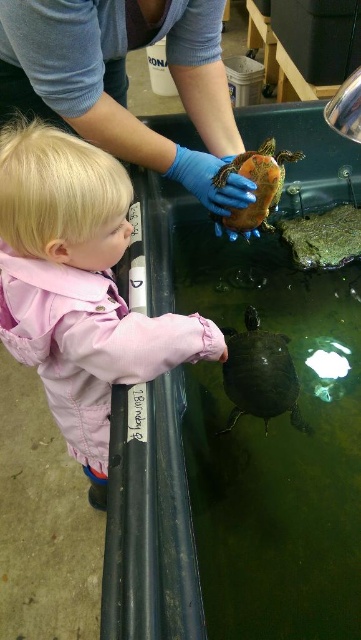
You are a safety inspector checking the turtle handling procedures. The guidelines state that any object used to handle turtles must be at least twice the turtle size to ensure safety. Based on the scene, can the blue rubber glove at upper center safely handle the shiny orange tortoise at center?

The blue rubber glove at upper center is larger than the shiny orange tortoise at center. However, the description only states that the glove is larger, not specifying it is twice the size. Without exact measurements, we cannot confirm if it meets the safety requirement of being at least twice the turtle size.

Looking at this image, what are the coordinates of the blue rubber glove at upper center?

The coordinates of the blue rubber glove at upper center are at point (x=125, y=81).

Looking at this image, you are a visitor at the turtle exhibit and want to know the position of the shiny dark green tortoise at center relative to the shiny orange tortoise at center. Which direction is it in?

The shiny dark green tortoise at center is located below the shiny orange tortoise at center.